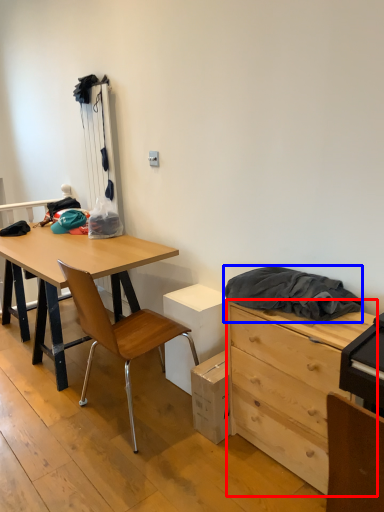
Question: Which object is further to the camera taking this photo, chest of drawers (highlighted by a red box) or clothing (highlighted by a blue box)?

Choices:
 (A) chest of drawers
 (B) clothing

Answer: (B)